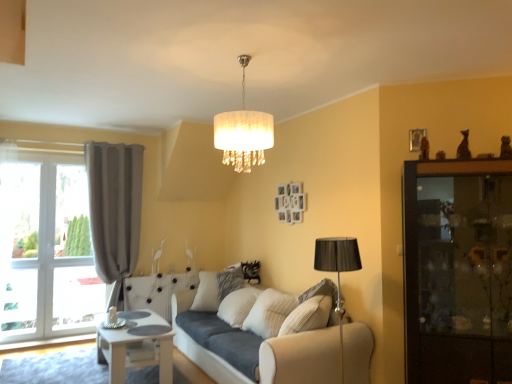
Image resolution: width=512 pixels, height=384 pixels. Identify the location of white fabric lampshade at center. (243, 132).

Describe the element at coordinates (243, 132) in the screenshot. I see `white fabric lampshade at center` at that location.

This screenshot has height=384, width=512. What do you see at coordinates (458, 271) in the screenshot? I see `dark wood cabinet at right` at bounding box center [458, 271].

The width and height of the screenshot is (512, 384). Describe the element at coordinates (137, 349) in the screenshot. I see `white painted wood table at lower left` at that location.

Locate an element on the screen. The width and height of the screenshot is (512, 384). matte gray curtain at left is located at coordinates (115, 211).

In terms of width, does dark wood cabinet at right look wider or thinner when compared to beige fabric couch at center?

Clearly, dark wood cabinet at right has less width compared to beige fabric couch at center.

In the image, there is a dark wood cabinet at right. Where is `studio couch below it (from the image's perspective)`? studio couch below it (from the image's perspective) is located at coordinates (253, 349).

From the image's perspective, is dark wood cabinet at right located above or below beige fabric couch at center?

Clearly, from the image's perspective, dark wood cabinet at right is above beige fabric couch at center.

Is beige fabric couch at center situated inside white fabric lampshade at center or outside?

beige fabric couch at center is outside white fabric lampshade at center.

From the image's perspective, which object appears higher, beige fabric couch at center or white fabric lampshade at center?

white fabric lampshade at center.

This screenshot has width=512, height=384. In order to click on curtain above the white painted wood table at lower left (from the image's perspective) in this screenshot , I will do `click(115, 211)`.

Is white painted wood table at lower left outside of matte gray curtain at left?

Indeed, white painted wood table at lower left is completely outside matte gray curtain at left.

From a real-world perspective, is white painted wood table at lower left above or below matte gray curtain at left?

From a real-world perspective, white painted wood table at lower left is physically below matte gray curtain at left.

Would you say white painted wood table at lower left is a long distance from matte gray curtain at left?

Indeed, white painted wood table at lower left is not near matte gray curtain at left.

Looking at this image, which of these two, beige fabric couch at center or dark wood cabinet at right, is bigger?

With larger size is beige fabric couch at center.

How different are the orientations of beige fabric couch at center and dark wood cabinet at right in degrees?

The angular difference between beige fabric couch at center and dark wood cabinet at right is 45.6 degrees.

At what (x,y) coordinates should I click in order to perform the action: click on studio couch below the dark wood cabinet at right (from a real-world perspective). Please return your answer as a coordinate pair (x, y). The image size is (512, 384). Looking at the image, I should click on (253, 349).

From the image's perspective, would you say beige fabric couch at center is positioned over dark wood cabinet at right?

Actually, beige fabric couch at center appears below dark wood cabinet at right in the image.

Can you see white fabric lampshade at center touching matte gray curtain at left?

No, white fabric lampshade at center is not next to matte gray curtain at left.

From the image's perspective, does white fabric lampshade at center appear lower than matte gray curtain at left?

No, from the image's perspective, white fabric lampshade at center is not below matte gray curtain at left.

Which is in front, white fabric lampshade at center or matte gray curtain at left?

white fabric lampshade at center.

Who is shorter, white fabric lampshade at center or matte gray curtain at left?

Standing shorter between the two is white fabric lampshade at center.

Are dark wood cabinet at right and matte gray curtain at left beside each other?

No, dark wood cabinet at right is not next to matte gray curtain at left.

Identify the location of dresser that is in front of the matte gray curtain at left. (458, 271).

Looking at their sizes, would you say dark wood cabinet at right is wider or thinner than matte gray curtain at left?

dark wood cabinet at right is wider than matte gray curtain at left.

Considering the relative positions of dark wood cabinet at right and matte gray curtain at left in the image provided, is dark wood cabinet at right in front of matte gray curtain at left?

Yes, dark wood cabinet at right is in front of matte gray curtain at left.

Is beige fabric couch at center to the right of white painted wood table at lower left from the viewer's perspective?

Indeed, beige fabric couch at center is positioned on the right side of white painted wood table at lower left.

How different are the orientations of beige fabric couch at center and white painted wood table at lower left in degrees?

The angular difference between beige fabric couch at center and white painted wood table at lower left is 1.16 degrees.

Based on the photo, would you consider beige fabric couch at center to be distant from white painted wood table at lower left?

Actually, beige fabric couch at center and white painted wood table at lower left are a little close together.

Identify the location of studio couch behind the dark wood cabinet at right. (253, 349).

At what (x,y) coordinates should I click in order to perform the action: click on lamp above the beige fabric couch at center (from the image's perspective). Please return your answer as a coordinate pair (x, y). Looking at the image, I should click on (243, 132).

From the image, which object appears to be nearer to white fabric lampshade at center, dark wood cabinet at right or matte gray curtain at left?

The object closer to white fabric lampshade at center is dark wood cabinet at right.

Which object lies further to the anchor point beige fabric couch at center, white fabric lampshade at center or dark wood cabinet at right?

Based on the image, white fabric lampshade at center appears to be further to beige fabric couch at center.

From the image, which object appears to be farther from white fabric lampshade at center, beige fabric couch at center or white painted wood table at lower left?

white painted wood table at lower left.

Estimate the real-world distances between objects in this image. Which object is closer to white fabric lampshade at center, white painted wood table at lower left or dark wood cabinet at right?

Based on the image, dark wood cabinet at right appears to be nearer to white fabric lampshade at center.

Looking at the image, which one is located further to white painted wood table at lower left, dark wood cabinet at right or beige fabric couch at center?

dark wood cabinet at right is further to white painted wood table at lower left.

When comparing their distances from white fabric lampshade at center, does matte gray curtain at left or dark wood cabinet at right seem further?

Among the two, matte gray curtain at left is located further to white fabric lampshade at center.

From the image, which object appears to be farther from beige fabric couch at center, dark wood cabinet at right or matte gray curtain at left?

matte gray curtain at left lies further to beige fabric couch at center than the other object.

Looking at the image, which one is located closer to white painted wood table at lower left, white fabric lampshade at center or beige fabric couch at center?

beige fabric couch at center.

Find the location of `studio couch positioned between white fabric lampshade at center and matte gray curtain at left from near to far`. studio couch positioned between white fabric lampshade at center and matte gray curtain at left from near to far is located at coordinates (253, 349).

This screenshot has width=512, height=384. What are the coordinates of `lamp situated between matte gray curtain at left and dark wood cabinet at right from left to right` in the screenshot? It's located at (243, 132).

Where is `dresser that lies between white fabric lampshade at center and beige fabric couch at center from top to bottom`? The image size is (512, 384). dresser that lies between white fabric lampshade at center and beige fabric couch at center from top to bottom is located at coordinates (458, 271).

What are the coordinates of `table located between matte gray curtain at left and dark wood cabinet at right in the left-right direction` in the screenshot? It's located at (137, 349).